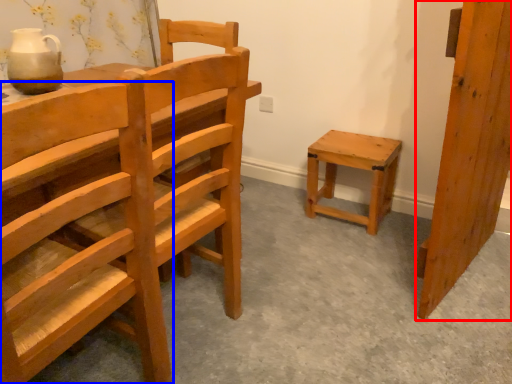
Question: Which object appears closest to the camera in this image, wood (highlighted by a red box) or chair (highlighted by a blue box)?

Choices:
 (A) wood
 (B) chair

Answer: (B)